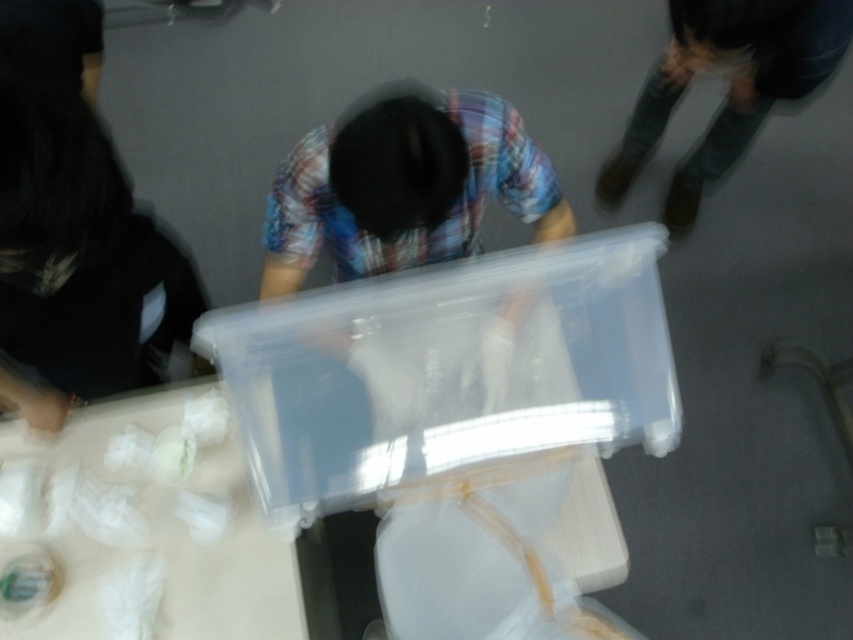
You are organizing items in a room and need to know which object takes up more space. Based on the scene, which one is larger between the translucent plastic table at lower left and the dark blue jeans at upper right?

The dark blue jeans at upper right takes up more space than the translucent plastic table at lower left according to the description.

You are organizing a clothing donation drive and need to determine which items can fit into a standard donation bin. Given the black matte shirt at left and the dark blue jeans at upper right, which item would require more space in the bin?

The dark blue jeans at upper right require more space in the bin since they are larger than the black matte shirt at left.